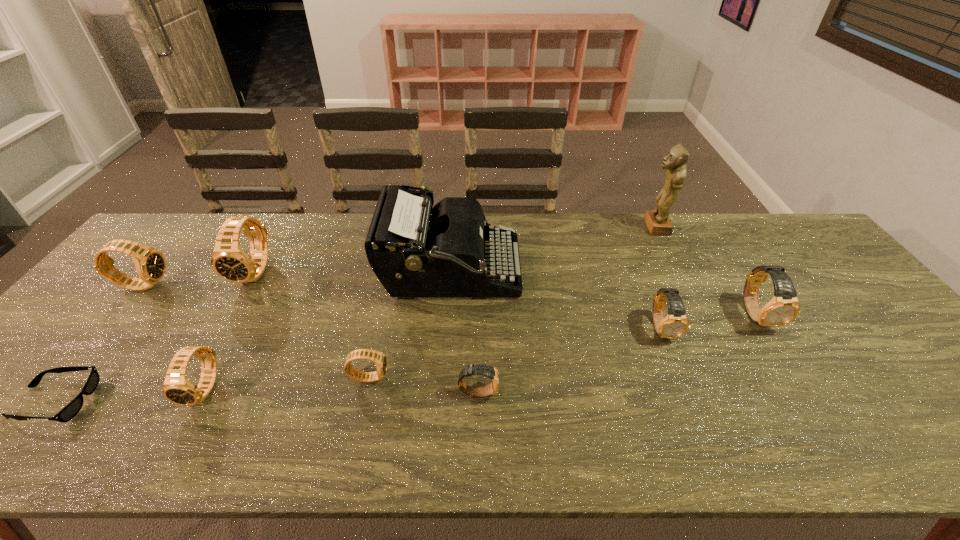
Find the location of a particular element. object positioned at the left edge is located at coordinates (150, 264).

This screenshot has height=540, width=960. I want to click on vacant space at the far edge, so click(613, 248).

At what (x,y) coordinates should I click in order to perform the action: click on vacant space at the near edge. Please return your answer as a coordinate pair (x, y). Looking at the image, I should click on (900, 435).

Find the location of a particular element. vacant space at the left edge of the desktop is located at coordinates (81, 339).

Locate an element on the screen. vacant region at the right edge of the desktop is located at coordinates point(875,375).

Image resolution: width=960 pixels, height=540 pixels. In the image, there is a desktop. Identify the location of blank space at the far right corner. (778, 246).

Locate an element on the screen. Image resolution: width=960 pixels, height=540 pixels. vacant area that lies between the rightmost gold watch and the rightmost black watch is located at coordinates (563, 346).

Locate an element on the screen. The height and width of the screenshot is (540, 960). free point between the figurine and the rightmost object is located at coordinates (706, 271).

The width and height of the screenshot is (960, 540). Identify the location of vacant point located between the smallest black watch and the second watch from right to left. [x=516, y=353].

At what (x,y) coordinates should I click in order to perform the action: click on free area in between the ninth object from left to right and the second smallest black watch. Please return your answer as a coordinate pair (x, y). The image size is (960, 540). Looking at the image, I should click on (430, 308).